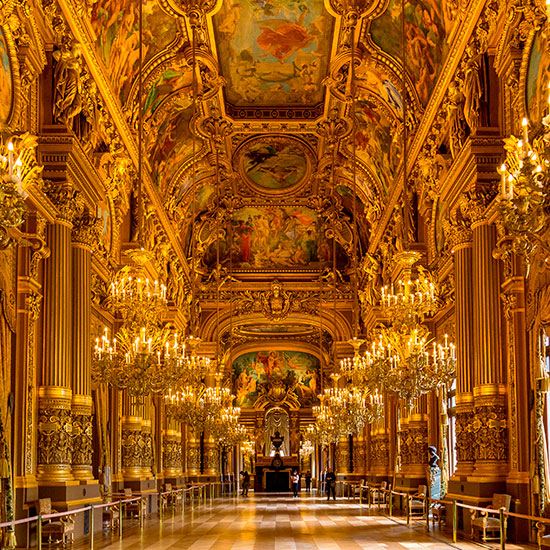
Identify the location of chair. (59, 529), (126, 490), (169, 488), (490, 521), (376, 490), (412, 503), (357, 486).